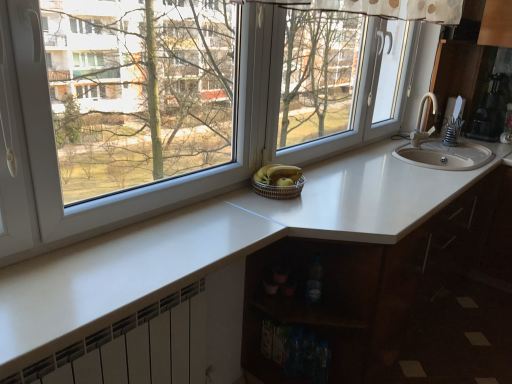
The image size is (512, 384). I want to click on vacant space to the left of woven brown basket at center, so click(239, 193).